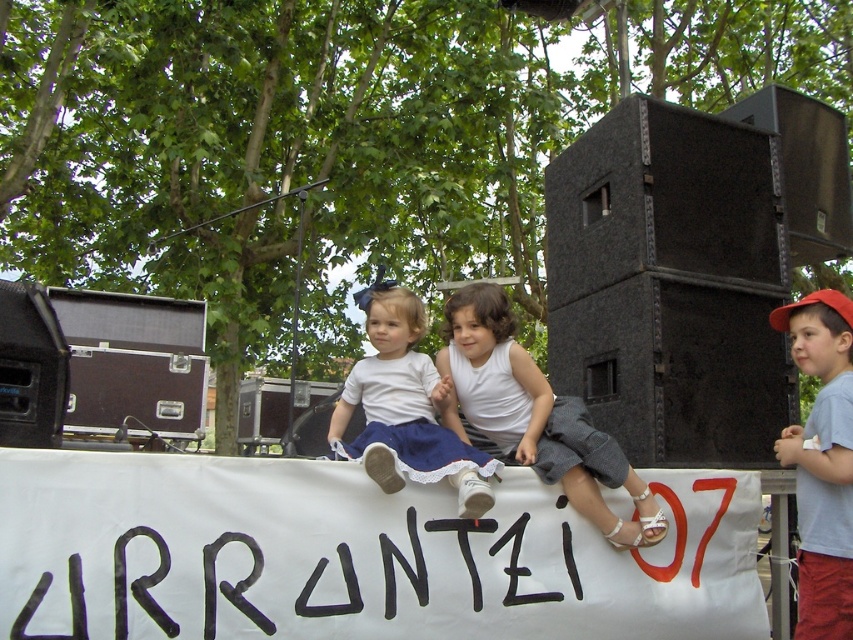
Question: Among these objects, which one is nearest to the camera?

Choices:
 (A) light blue t-shirt at center
 (B) white paper banner at center

Answer: (B)

Question: Can you confirm if white cotton shirt at center is wider than light blue t-shirt at center?

Choices:
 (A) yes
 (B) no

Answer: (A)

Question: Which of the following is the farthest from the observer?

Choices:
 (A) white paper banner at center
 (B) white cotton shirt at center
 (C) light blue t-shirt at center

Answer: (B)

Question: Is white cotton shirt at center in front of light blue t-shirt at center?

Choices:
 (A) no
 (B) yes

Answer: (A)

Question: Does white paper banner at center appear under white cotton dress at center?

Choices:
 (A) yes
 (B) no

Answer: (A)

Question: Estimate the real-world distances between objects in this image. Which object is closer to the white cotton dress at center?

Choices:
 (A) white paper banner at center
 (B) light blue t-shirt at center
 (C) white cotton shirt at center

Answer: (C)